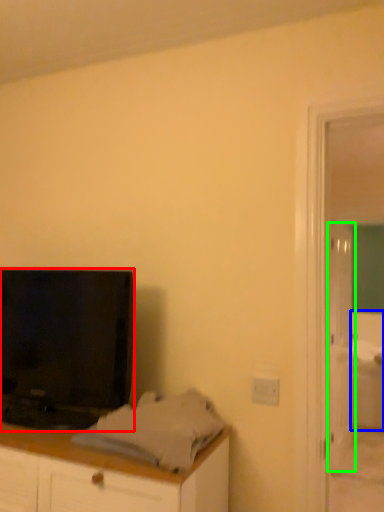
Question: Based on their relative distances, which object is nearer to television (highlighted by a red box)? Choose from bed (highlighted by a blue box) and door (highlighted by a green box).

Choices:
 (A) bed
 (B) door

Answer: (B)